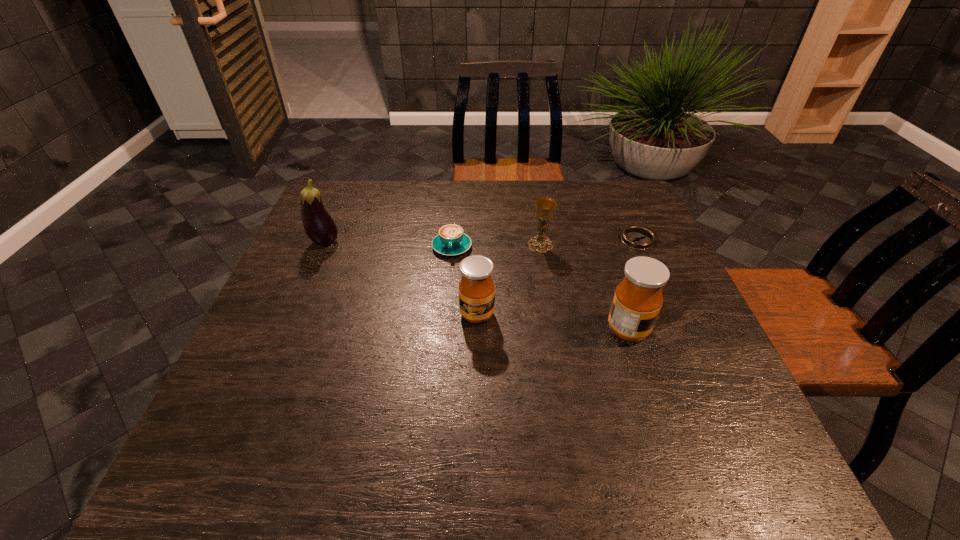
Select which object appears as the closest to the third object from right to left. Please provide its 2D coordinates. Your answer should be formatted as a tuple, i.e. [(x, y)], where the tuple contains the x and y coordinates of a point satisfying the conditions above.

[(451, 240)]

Locate an element on the screen. object that is the fourth closest one to the rightmost object is located at coordinates [x=451, y=240].

This screenshot has height=540, width=960. I want to click on free space in the image that satisfies the following two spatial constraints: 1. on the back side of the shortest object; 2. on the left side of the chalice, so click(540, 240).